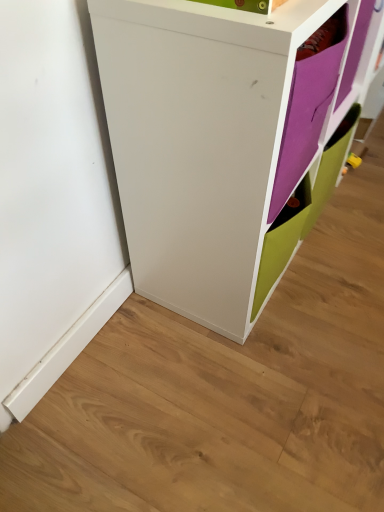
Question: Can you confirm if white matte cabinet at center is shorter than purple matte paper at upper right?

Choices:
 (A) no
 (B) yes

Answer: (A)

Question: Is white matte cabinet at center wider than purple matte paper at upper right?

Choices:
 (A) no
 (B) yes

Answer: (B)

Question: Considering the relative positions of white matte cabinet at center and purple matte paper at upper right in the image provided, is white matte cabinet at center to the left of purple matte paper at upper right from the viewer's perspective?

Choices:
 (A) no
 (B) yes

Answer: (B)

Question: Is white matte cabinet at center not inside purple matte paper at upper right?

Choices:
 (A) no
 (B) yes

Answer: (B)

Question: Considering the relative sizes of white matte cabinet at center and purple matte paper at upper right in the image provided, is white matte cabinet at center taller than purple matte paper at upper right?

Choices:
 (A) no
 (B) yes

Answer: (B)

Question: Is white matte cabinet at center next to purple matte paper at upper right and touching it?

Choices:
 (A) yes
 (B) no

Answer: (B)

Question: Is purple matte paper at upper right to the right of white matte cabinet at center from the viewer's perspective?

Choices:
 (A) no
 (B) yes

Answer: (B)

Question: Is white matte cabinet at center completely or partially inside purple matte paper at upper right?

Choices:
 (A) no
 (B) yes

Answer: (A)

Question: Is purple matte paper at upper right located outside white matte cabinet at center?

Choices:
 (A) yes
 (B) no

Answer: (B)

Question: From a real-world perspective, is purple matte paper at upper right located beneath white matte cabinet at center?

Choices:
 (A) no
 (B) yes

Answer: (A)

Question: Does purple matte paper at upper right come behind white matte cabinet at center?

Choices:
 (A) no
 (B) yes

Answer: (B)

Question: From a real-world perspective, is purple matte paper at upper right physically above white matte cabinet at center?

Choices:
 (A) no
 (B) yes

Answer: (B)

Question: Is point (178, 281) closer or farther from the camera than point (294, 160)?

Choices:
 (A) farther
 (B) closer

Answer: (A)